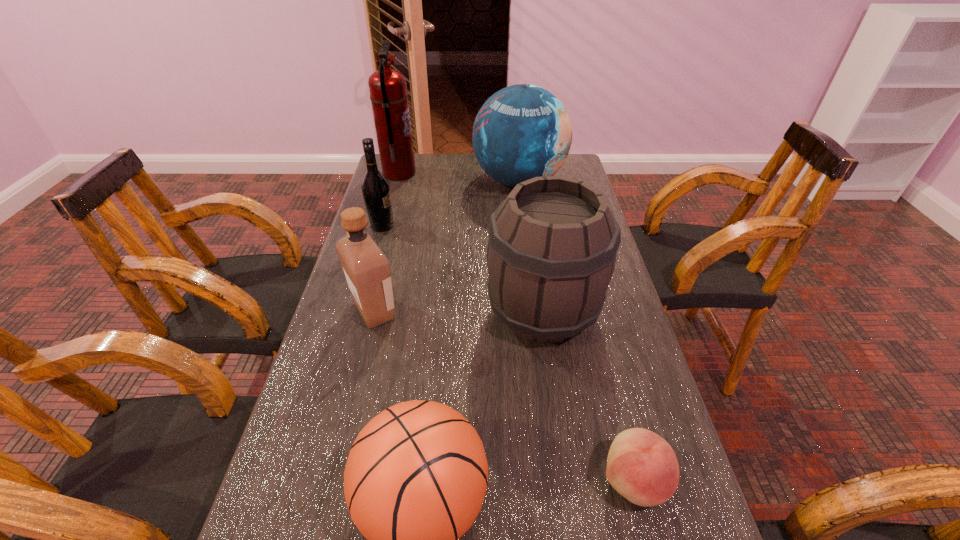
Where is `object that is at the far left corner`? object that is at the far left corner is located at coordinates (388, 90).

Where is `object that is at the far right corner`? The height and width of the screenshot is (540, 960). object that is at the far right corner is located at coordinates click(523, 131).

In the image, there is a desktop. Where is `vacant space at the left edge`? vacant space at the left edge is located at coordinates (340, 513).

The height and width of the screenshot is (540, 960). I want to click on vacant space at the right edge of the desktop, so click(x=630, y=342).

Find the location of a particular element. This screenshot has height=540, width=960. vacant space at the far right corner of the desktop is located at coordinates (577, 166).

The image size is (960, 540). Find the location of `free spot between the fifth nearest object and the wine bucket`. free spot between the fifth nearest object and the wine bucket is located at coordinates (463, 269).

Locate an element on the screen. object that ranks as the sixth closest to the basketball is located at coordinates (388, 90).

At what (x,y) coordinates should I click in order to perform the action: click on object that ranks as the sixth closest to the wine bucket. Please return your answer as a coordinate pair (x, y). Looking at the image, I should click on (388, 90).

Where is `vacant space that satisfies the following two spatial constraints: 1. on the side of the tallest object with the handle and hose; 2. on the left side of the peach`? vacant space that satisfies the following two spatial constraints: 1. on the side of the tallest object with the handle and hose; 2. on the left side of the peach is located at coordinates (315, 480).

Find the location of a particular element. The height and width of the screenshot is (540, 960). free space that satisfies the following two spatial constraints: 1. on the back side of the shortest object; 2. on the front-facing side of the liquor is located at coordinates (590, 311).